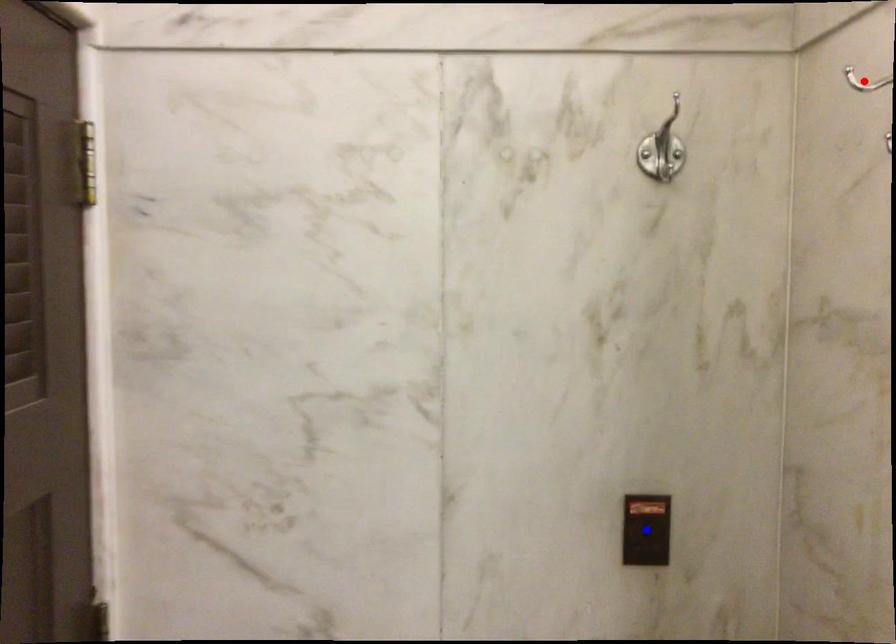
Question: Which of the two points in the image is closer to the camera?

Choices:
 (A) Blue point is closer.
 (B) Red point is closer.

Answer: (B)